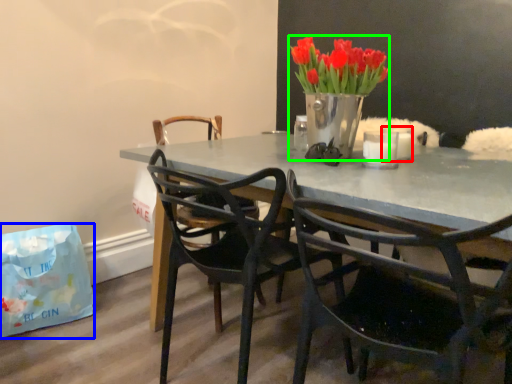
Question: Which is nearer to the candle (highlighted by a red box)? handbag (highlighted by a blue box) or houseplant (highlighted by a green box).

Choices:
 (A) handbag
 (B) houseplant

Answer: (B)